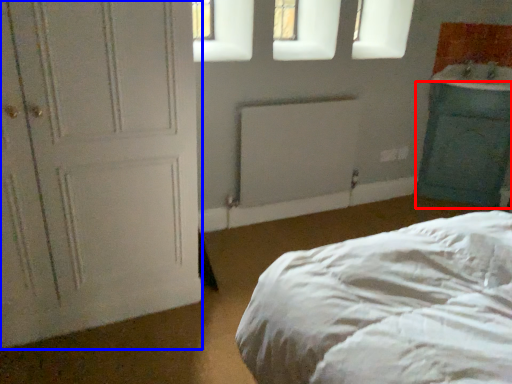
Question: Which object is closer to the camera taking this photo, cabinetry (highlighted by a red box) or door (highlighted by a blue box)?

Choices:
 (A) cabinetry
 (B) door

Answer: (B)